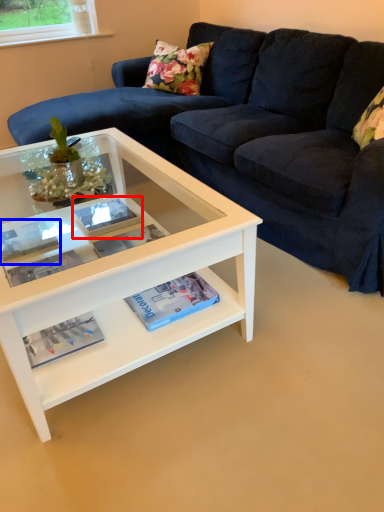
Question: Which point is further to the camera, paperback book (highlighted by a red box) or book (highlighted by a blue box)?

Choices:
 (A) paperback book
 (B) book

Answer: (A)